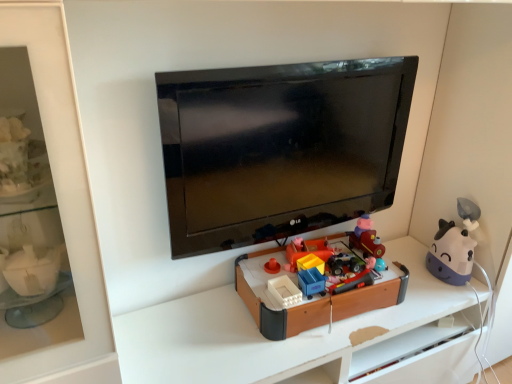
Question: Is brown plastic toy at center, which is the fifth toy from right to left, far from rubberized plastic toy car at center, which is the third toy in right-to-left order?

Choices:
 (A) yes
 (B) no

Answer: (B)

Question: Considering the relative sizes of brown plastic toy at center, which is the fifth toy from right to left, and rubberized plastic toy car at center, which is the third toy in right-to-left order, in the image provided, is brown plastic toy at center, which is the fifth toy from right to left, bigger than rubberized plastic toy car at center, which is the third toy in right-to-left order,?

Choices:
 (A) no
 (B) yes

Answer: (B)

Question: Considering the relative positions of brown plastic toy at center, which appears as the 2th toy when viewed from the left, and rubberized plastic toy car at center, which is the third toy in right-to-left order, in the image provided, is brown plastic toy at center, which appears as the 2th toy when viewed from the left, to the left of rubberized plastic toy car at center, which is the third toy in right-to-left order, from the viewer's perspective?

Choices:
 (A) yes
 (B) no

Answer: (A)

Question: Does brown plastic toy at center, which appears as the 2th toy when viewed from the left, turn towards rubberized plastic toy car at center, which is the third toy in right-to-left order?

Choices:
 (A) yes
 (B) no

Answer: (B)

Question: From a real-world perspective, is brown plastic toy at center, which is the fifth toy from right to left, located higher than rubberized plastic toy car at center, the fourth toy when ordered from left to right?

Choices:
 (A) yes
 (B) no

Answer: (B)

Question: Is the surface of brown plastic toy at center, which is the fifth toy from right to left, in direct contact with rubberized plastic toy car at center, which is the third toy in right-to-left order?

Choices:
 (A) no
 (B) yes

Answer: (A)

Question: Can you confirm if rubberized plastic toy car at center, which is the third toy in right-to-left order, is wider than purple matte cow at right, which is the first toy in right-to-left order?

Choices:
 (A) no
 (B) yes

Answer: (A)

Question: Does rubberized plastic toy car at center, the fourth toy when ordered from left to right, have a lesser width compared to purple matte cow at right, positioned as the 6th toy in left-to-right order?

Choices:
 (A) yes
 (B) no

Answer: (A)

Question: From a real-world perspective, is rubberized plastic toy car at center, which is the third toy in right-to-left order, below purple matte cow at right, positioned as the 6th toy in left-to-right order?

Choices:
 (A) yes
 (B) no

Answer: (B)

Question: Does rubberized plastic toy car at center, which is the third toy in right-to-left order, touch purple matte cow at right, positioned as the 6th toy in left-to-right order?

Choices:
 (A) no
 (B) yes

Answer: (A)

Question: Does rubberized plastic toy car at center, the fourth toy when ordered from left to right, have a larger size compared to purple matte cow at right, which is the first toy in right-to-left order?

Choices:
 (A) yes
 (B) no

Answer: (B)

Question: From a real-world perspective, is rubberized plastic toy car at center, which is the third toy in right-to-left order, on top of purple matte cow at right, which is the first toy in right-to-left order?

Choices:
 (A) no
 (B) yes

Answer: (B)

Question: Is purple matte cow at right, which is the first toy in right-to-left order, at the back of matte plastic toy train at center, arranged as the fifth toy when viewed from the left?

Choices:
 (A) yes
 (B) no

Answer: (B)